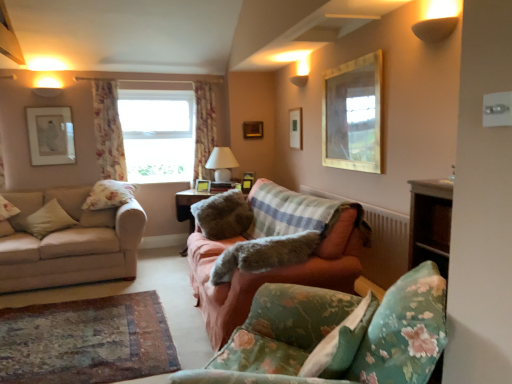
Question: Should I look upward or downward to see floral fabric curtain at upper left, arranged as the second curtain when viewed from the right?

Choices:
 (A) up
 (B) down

Answer: (A)

Question: Does wooden picture frame at center, which is the 5th picture frame from right to left, have a greater width compared to pink fabric couch at center, placed as the second studio couch when sorted from left to right?

Choices:
 (A) yes
 (B) no

Answer: (B)

Question: Would you consider wooden picture frame at center, which is the 5th picture frame from right to left, to be distant from pink fabric couch at center, placed as the second studio couch when sorted from left to right?

Choices:
 (A) yes
 (B) no

Answer: (A)

Question: From a real-world perspective, is wooden picture frame at center, which is the 2th picture frame in left-to-right order, physically below pink fabric couch at center, which appears as the 2th studio couch when viewed from the right?

Choices:
 (A) no
 (B) yes

Answer: (A)

Question: Is wooden picture frame at center, which is the 2th picture frame in left-to-right order, turned away from pink fabric couch at center, which appears as the 2th studio couch when viewed from the right?

Choices:
 (A) no
 (B) yes

Answer: (A)

Question: Can we say wooden picture frame at center, which is the 2th picture frame in left-to-right order, lies outside pink fabric couch at center, placed as the second studio couch when sorted from left to right?

Choices:
 (A) yes
 (B) no

Answer: (A)

Question: Can you confirm if wooden picture frame at center, which is the 5th picture frame from right to left, is smaller than pink fabric couch at center, placed as the second studio couch when sorted from left to right?

Choices:
 (A) yes
 (B) no

Answer: (A)

Question: From the image's perspective, is gold textured picture frame at upper right, the first picture frame positioned from the front, on wooden picture frame at center, positioned as the fifth picture frame in front-to-back order?

Choices:
 (A) no
 (B) yes

Answer: (B)

Question: From the image's perspective, does gold textured picture frame at upper right, which is the 6th picture frame from left to right, appear lower than wooden picture frame at center, which is the 5th picture frame from right to left?

Choices:
 (A) yes
 (B) no

Answer: (B)

Question: Considering the relative sizes of gold textured picture frame at upper right, which is the 6th picture frame from left to right, and wooden picture frame at center, which is the 2th picture frame from back to front, in the image provided, is gold textured picture frame at upper right, which is the 6th picture frame from left to right, smaller than wooden picture frame at center, which is the 2th picture frame from back to front,?

Choices:
 (A) yes
 (B) no

Answer: (B)

Question: From a real-world perspective, is gold textured picture frame at upper right, the first picture frame positioned from the front, under wooden picture frame at center, which is the 2th picture frame in left-to-right order?

Choices:
 (A) no
 (B) yes

Answer: (A)

Question: Is gold textured picture frame at upper right, the 6th picture frame viewed from the back, positioned with its back to wooden picture frame at center, which is the 5th picture frame from right to left?

Choices:
 (A) yes
 (B) no

Answer: (B)

Question: Is the depth of gold textured picture frame at upper right, which appears as the 1th picture frame when viewed from the right, greater than that of wooden picture frame at center, which is the 5th picture frame from right to left?

Choices:
 (A) no
 (B) yes

Answer: (A)

Question: Considering the relative sizes of beige fabric couch at left, which is the first studio couch in left-to-right order, and floral fabric curtain at center, which is the second curtain from front to back, in the image provided, is beige fabric couch at left, which is the first studio couch in left-to-right order, bigger than floral fabric curtain at center, which is the second curtain from front to back,?

Choices:
 (A) yes
 (B) no

Answer: (A)